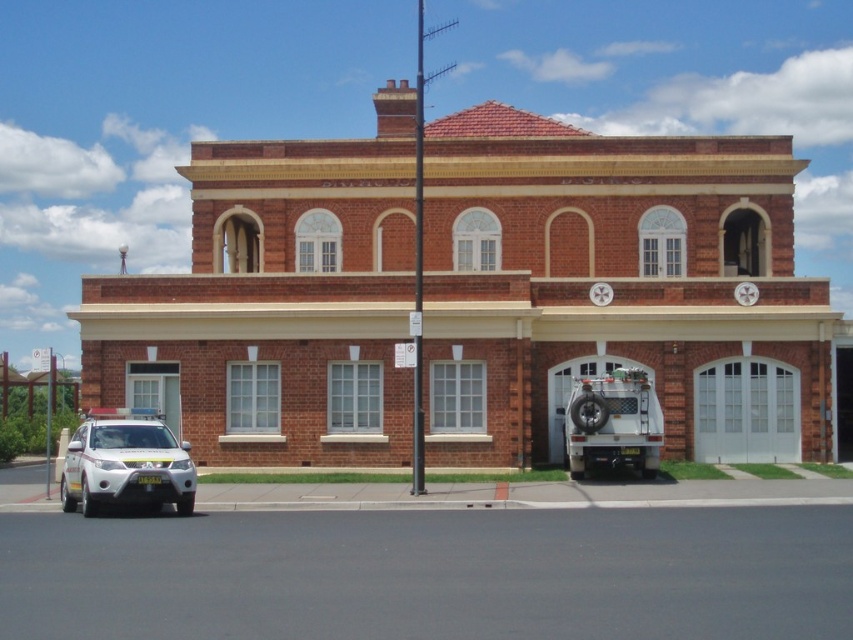
You are standing in front of the two story brick building. There is a point marked at coordinates (618,289). What is the object located at that point?

The point at coordinates (618,289) indicates the brown brick fire station at center.

You are a delivery driver approaching the brown brick fire station at center and the white matte suv at lower left. You need to park your vehicle in a spot that is directly in front of the building. Which vehicle is closer to the entrance of the building?

The brown brick fire station at center is above the white matte suv at lower left, meaning it is closer to the entrance of the building. Therefore, the brown brick fire station at center is closer to the entrance.

You are a delivery driver approaching the building and need to park your vehicle. You see a white matte suv at lower left and a white rubber fire truck at lower right. Which vehicle should you avoid parking near to ensure you don t block emergency access?

You should avoid parking near the white rubber fire truck at lower right because it is positioned above the white matte suv at lower left, indicating it might be near an emergency access point.